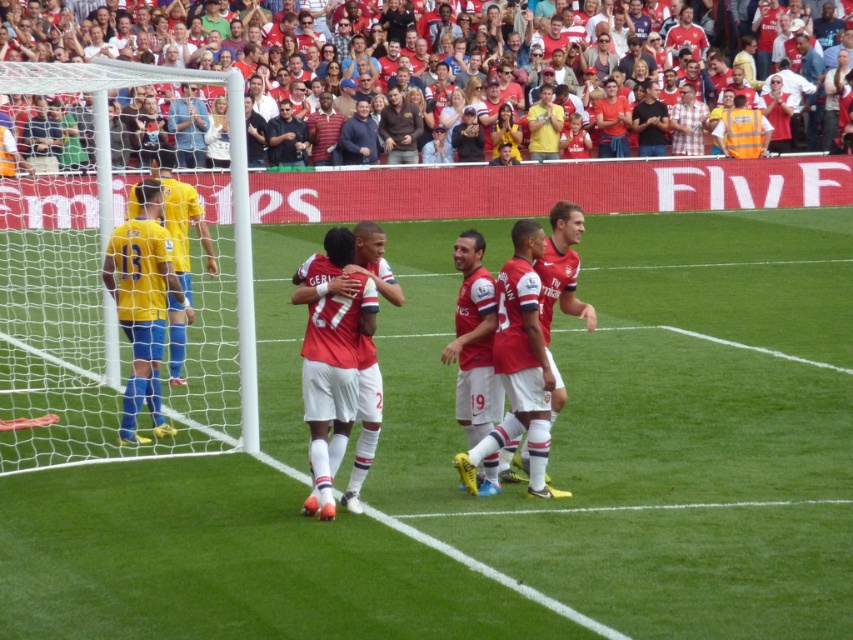
Can you confirm if red fabric crowd at upper center is shorter than matte red jersey at center?

Incorrect, red fabric crowd at upper center's height does not fall short of matte red jersey at center's.

Is red fabric crowd at upper center positioned at the back of matte red jersey at center?

→ Yes, red fabric crowd at upper center is behind matte red jersey at center.

This screenshot has width=853, height=640. I want to click on red fabric crowd at upper center, so click(x=54, y=136).

Who is positioned more to the right, yellow jersey at left or dark brown leather jacket at upper center?

From the viewer's perspective, dark brown leather jacket at upper center appears more on the right side.

Looking at this image, can you confirm if yellow jersey at left is positioned to the left of dark brown leather jacket at upper center?

Indeed, yellow jersey at left is positioned on the left side of dark brown leather jacket at upper center.

I want to click on yellow jersey at left, so [181, 218].

Between green grass at center and red fabric crowd at upper center, which one has more height?

Standing taller between the two is red fabric crowd at upper center.

Based on the photo, between green grass at center and red fabric crowd at upper center, which one is positioned higher?

red fabric crowd at upper center

Find the location of `green grass at center`. green grass at center is located at coordinates (654, 422).